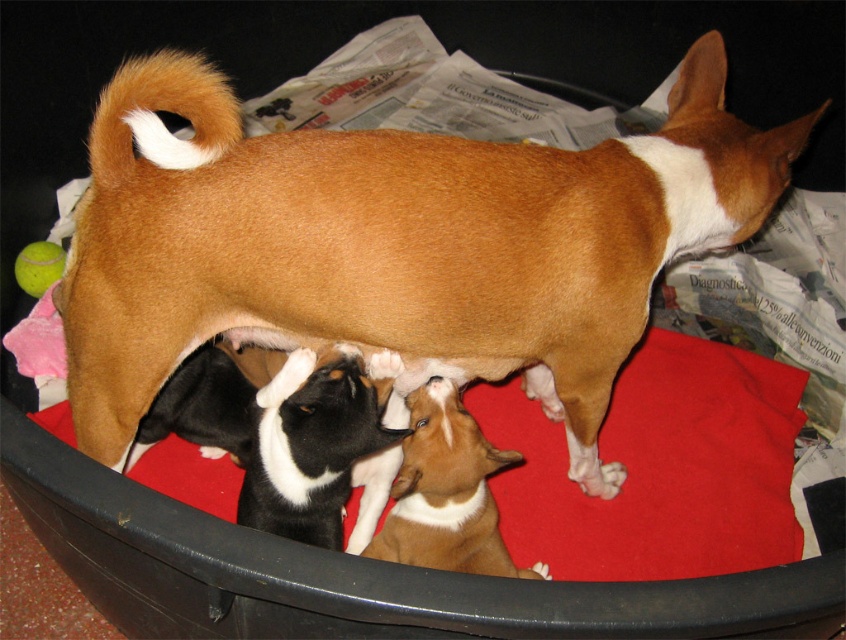
Is brown smooth fur dog at center bigger than brown smooth fur at center?

Indeed, brown smooth fur dog at center has a larger size compared to brown smooth fur at center.

This screenshot has height=640, width=846. What do you see at coordinates (393, 243) in the screenshot?
I see `brown smooth fur dog at center` at bounding box center [393, 243].

Identify the location of brown smooth fur dog at center. (393, 243).